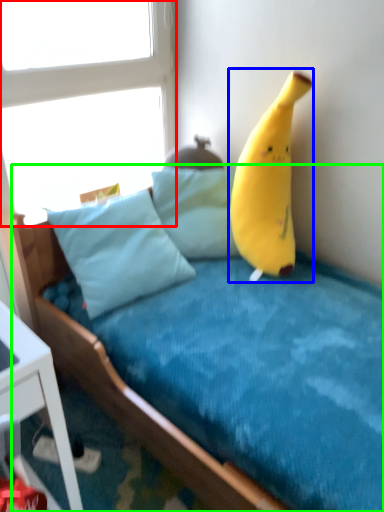
Question: Which object is positioned closest to window (highlighted by a red box)? Select from banana (highlighted by a blue box) and bed (highlighted by a green box).

Choices:
 (A) banana
 (B) bed

Answer: (A)